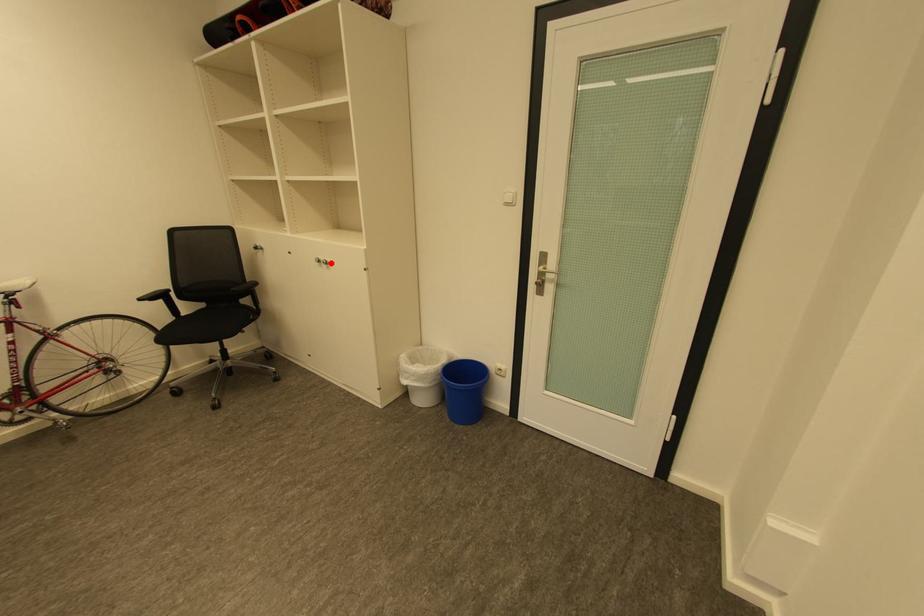
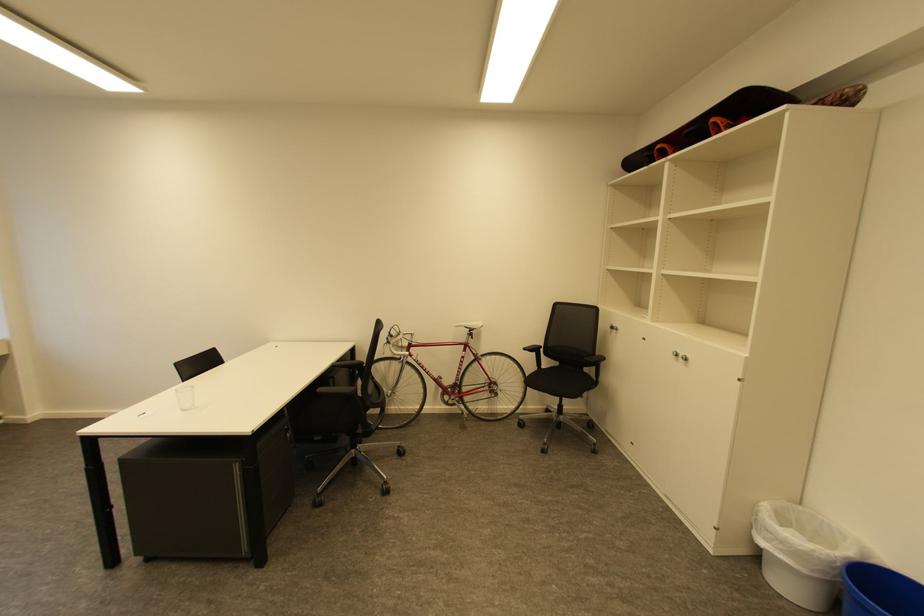
Find the pixel in the second image that matches the highlighted location in the first image.

(689, 359)